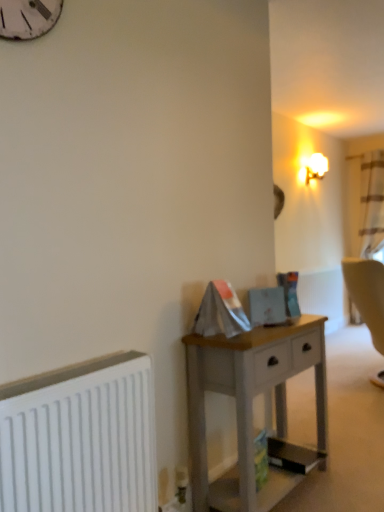
Question: Considering the relative sizes of white frosted glass lampshade at upper right and white painted wood desk at center in the image provided, is white frosted glass lampshade at upper right shorter than white painted wood desk at center?

Choices:
 (A) no
 (B) yes

Answer: (B)

Question: Is white frosted glass lampshade at upper right facing towards white painted wood desk at center?

Choices:
 (A) yes
 (B) no

Answer: (B)

Question: Would you consider white frosted glass lampshade at upper right to be distant from white painted wood desk at center?

Choices:
 (A) no
 (B) yes

Answer: (B)

Question: Can you confirm if white frosted glass lampshade at upper right is wider than white painted wood desk at center?

Choices:
 (A) no
 (B) yes

Answer: (A)

Question: Is white frosted glass lampshade at upper right next to white painted wood desk at center and touching it?

Choices:
 (A) no
 (B) yes

Answer: (A)

Question: Is white frosted glass lampshade at upper right taller than white painted wood desk at center?

Choices:
 (A) no
 (B) yes

Answer: (A)

Question: Can you confirm if white painted wood desk at center is smaller than white matte radiator at lower left?

Choices:
 (A) yes
 (B) no

Answer: (B)

Question: Is the position of white painted wood desk at center more distant than that of white matte radiator at lower left?

Choices:
 (A) no
 (B) yes

Answer: (B)

Question: Can you confirm if white painted wood desk at center is thinner than white matte radiator at lower left?

Choices:
 (A) yes
 (B) no

Answer: (B)

Question: Does white painted wood desk at center have a greater width compared to white matte radiator at lower left?

Choices:
 (A) no
 (B) yes

Answer: (B)

Question: From a real-world perspective, is white painted wood desk at center located beneath white matte radiator at lower left?

Choices:
 (A) yes
 (B) no

Answer: (A)

Question: Is white painted wood desk at center positioned with its back to white matte radiator at lower left?

Choices:
 (A) yes
 (B) no

Answer: (B)

Question: Is white painted wood desk at center with white frosted glass lampshade at upper right?

Choices:
 (A) yes
 (B) no

Answer: (B)